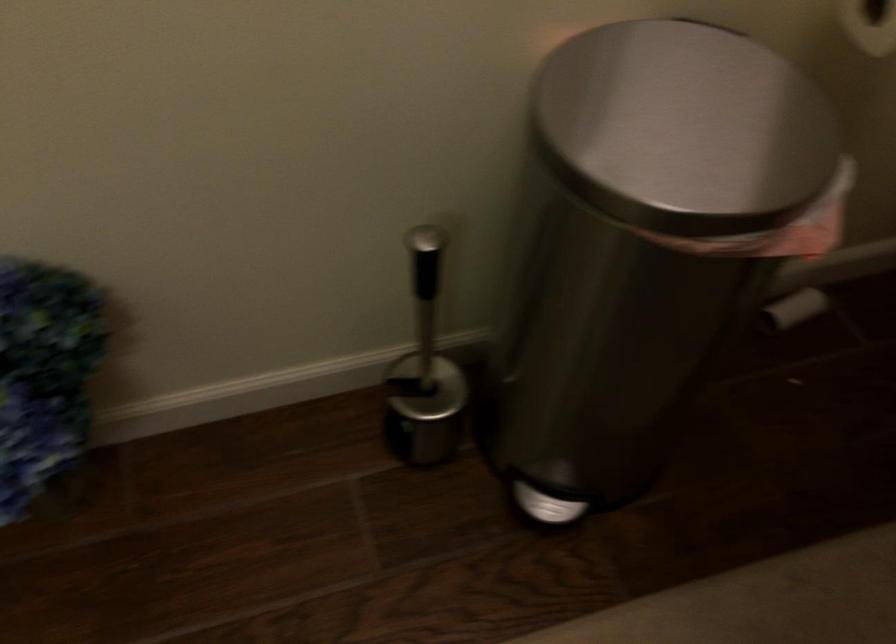
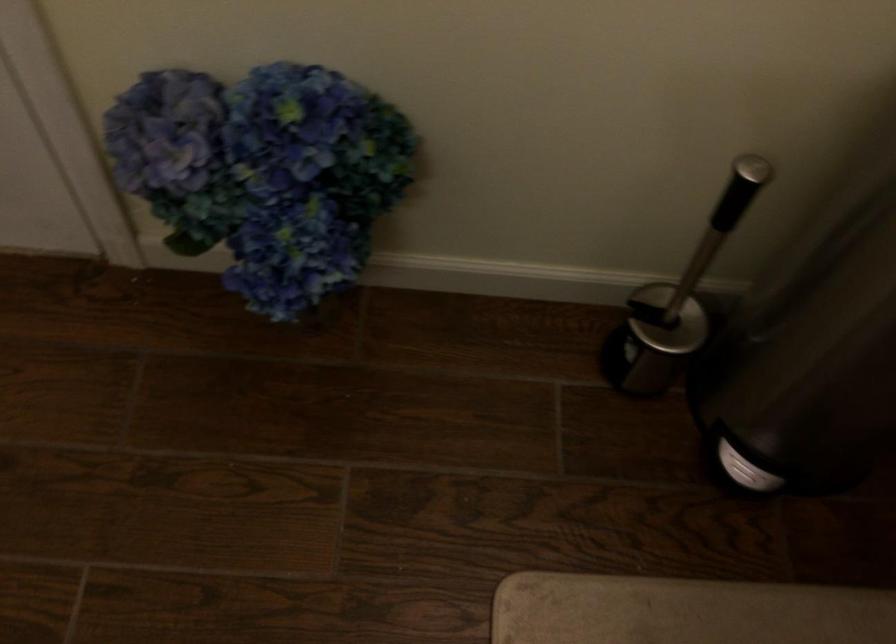
Where in the second image is the point corresponding to point (428, 295) from the first image?

(719, 225)